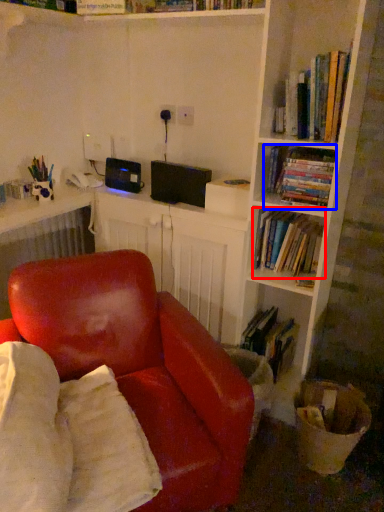
Question: Which object is closer to the camera taking this photo, book (highlighted by a red box) or book (highlighted by a blue box)?

Choices:
 (A) book
 (B) book

Answer: (B)